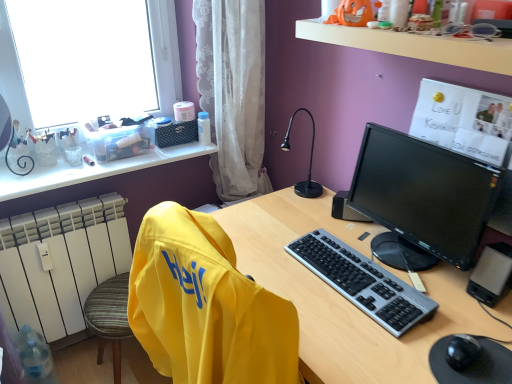
Where is `vacant space to the right of black plastic keyboard at center`? This screenshot has height=384, width=512. vacant space to the right of black plastic keyboard at center is located at coordinates (422, 274).